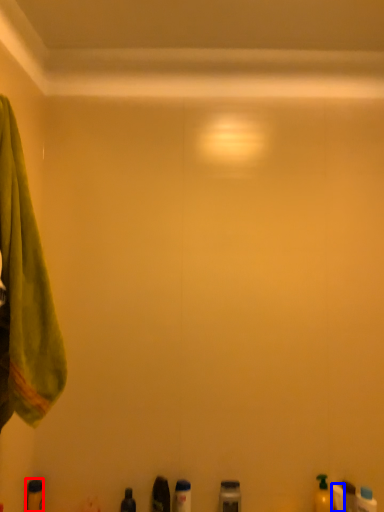
Question: Which of the following is the farthest to the observer, toiletry (highlighted by a red box) or toiletry (highlighted by a blue box)?

Choices:
 (A) toiletry
 (B) toiletry

Answer: (A)